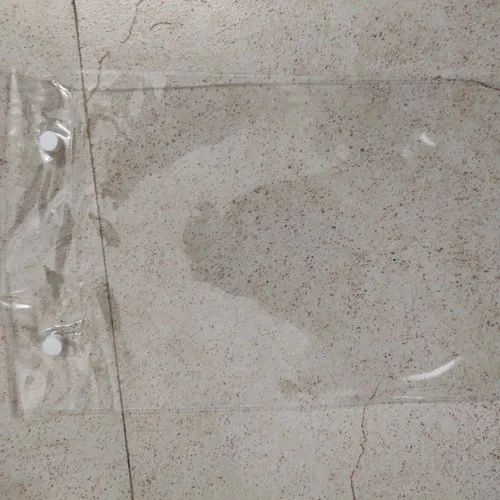
Where is `speckled flooring`? The image size is (500, 500). speckled flooring is located at coordinates (402, 466).